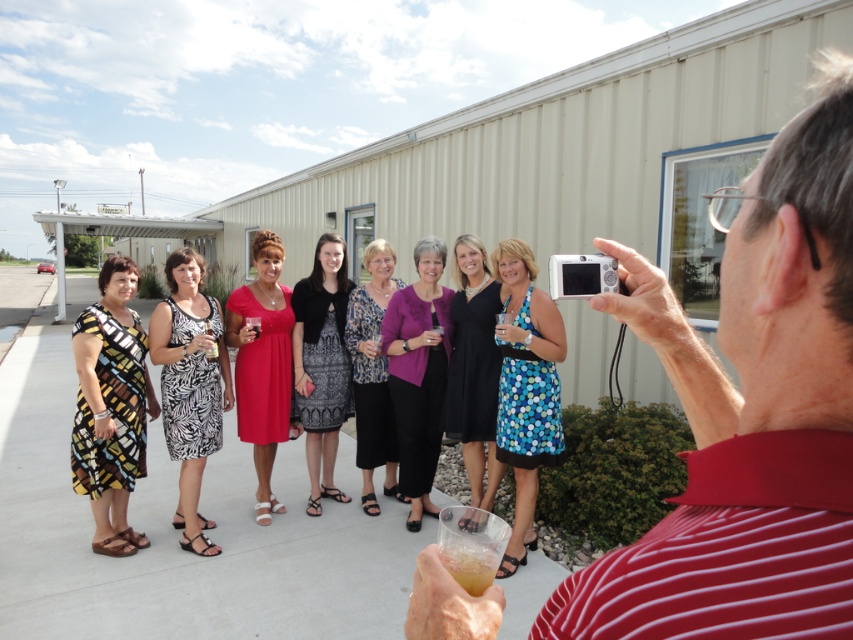
Which is above, purple matte cardigan at center or matte red dress at center?

matte red dress at center

Does point (421, 502) lie behind point (244, 298)?

Yes, point (421, 502) is farther from viewer.

Which is behind, point (402, 364) or point (264, 396)?

Positioned behind is point (264, 396).

Find the location of a particular element. The width and height of the screenshot is (853, 640). purple matte cardigan at center is located at coordinates (418, 372).

Who is higher up, purple matte dress at center or translucent plastic cup at lower center?

purple matte dress at center is higher up.

Can you confirm if purple matte dress at center is thinner than translucent plastic cup at lower center?

No.

Who is more forward, (389, 445) or (445, 548)?

Point (445, 548) is more forward.

At what (x,y) coordinates should I click in order to perform the action: click on purple matte dress at center. Please return your answer as a coordinate pair (x, y). Looking at the image, I should click on (372, 374).

Is point (531, 276) farther from viewer compared to point (447, 568)?

Yes, it is behind point (447, 568).

Is blue dotted dress at center above translucent plastic cup at lower center?

No, blue dotted dress at center is not above translucent plastic cup at lower center.

What are the coordinates of `blue dotted dress at center` in the screenshot? It's located at (526, 388).

Find the location of `blue dotted dress at center`. blue dotted dress at center is located at coordinates (526, 388).